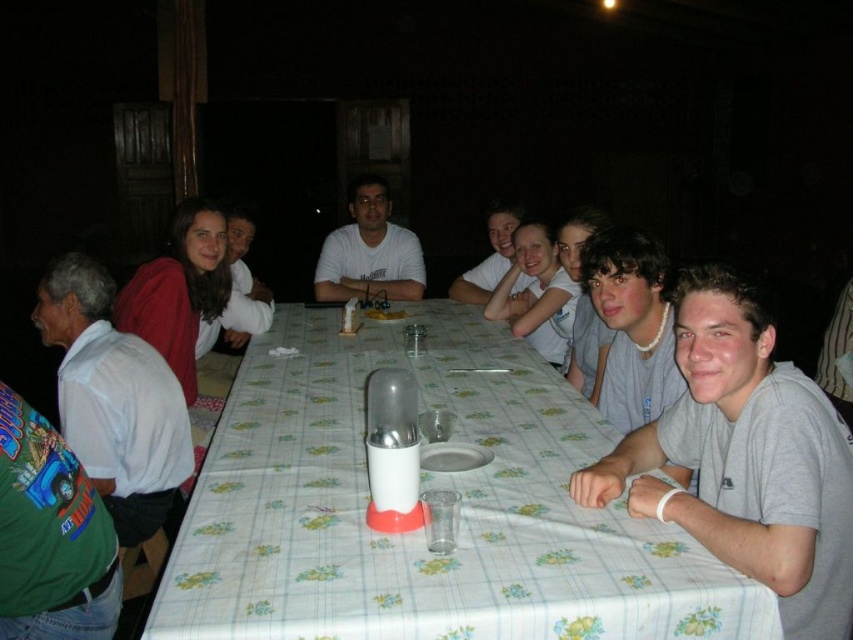
Which is in front, point (340, 269) or point (500, 273)?

Point (500, 273) is more forward.

Can you confirm if white matte shirt at center is positioned below smooth white shirt at center?

→ Incorrect, white matte shirt at center is not positioned below smooth white shirt at center.

Is point (375, 198) positioned in front of point (469, 276)?

No, it is not.

Image resolution: width=853 pixels, height=640 pixels. In order to click on white matte shirt at center in this screenshot , I will do `click(369, 252)`.

Is white matte shirt at left to the left of white matte shirt at center from the viewer's perspective?

Yes, white matte shirt at left is to the left of white matte shirt at center.

Looking at this image, measure the distance between white matte shirt at left and camera.

6.94 feet

Find the location of a particular element. white matte shirt at left is located at coordinates (113, 397).

Between point (178, 544) and point (134, 429), which one is positioned in front?

Point (178, 544)

Is white fabric table at center in front of white matte shirt at left?

Yes.

The image size is (853, 640). Find the location of `white fabric table at center`. white fabric table at center is located at coordinates (424, 486).